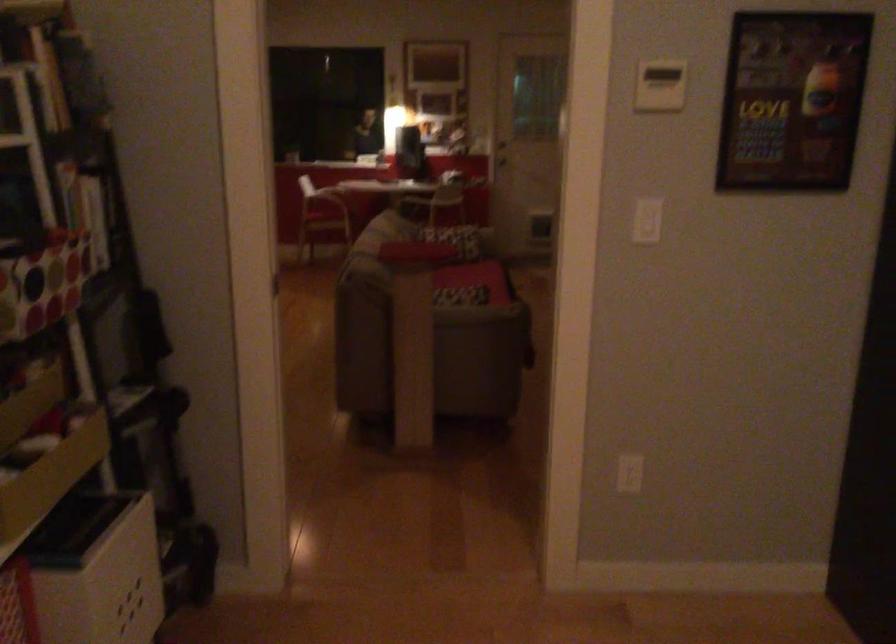
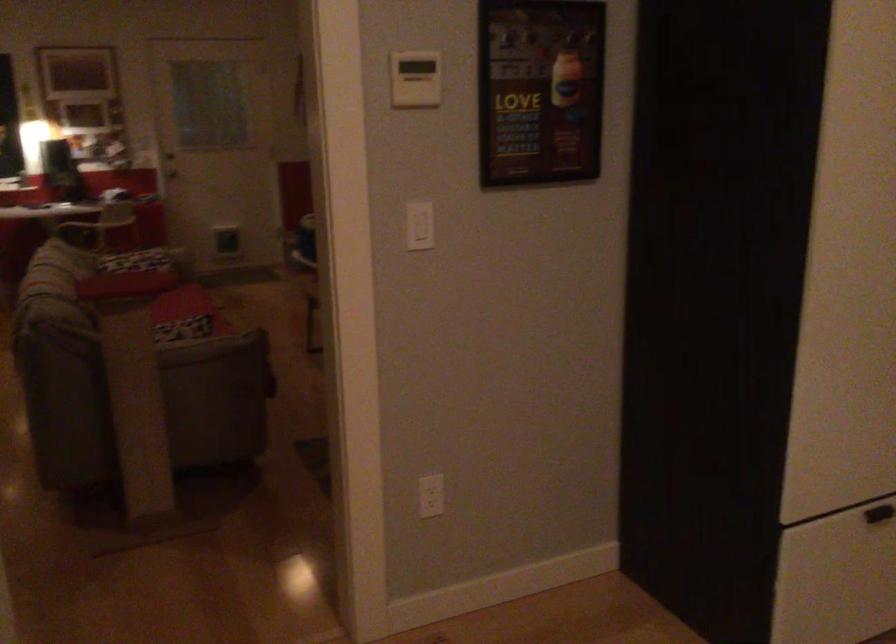
Which direction would the cameraman need to move to produce the second image?

The cameraman moved toward left, forward.